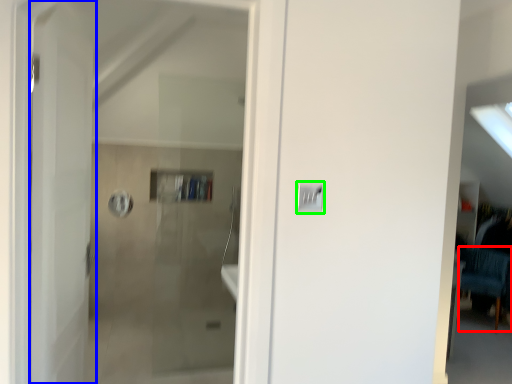
Question: Considering the real-world distances, which object is farthest from furniture (highlighted by a red box)? door (highlighted by a blue box) or light switch (highlighted by a green box)?

Choices:
 (A) door
 (B) light switch

Answer: (A)